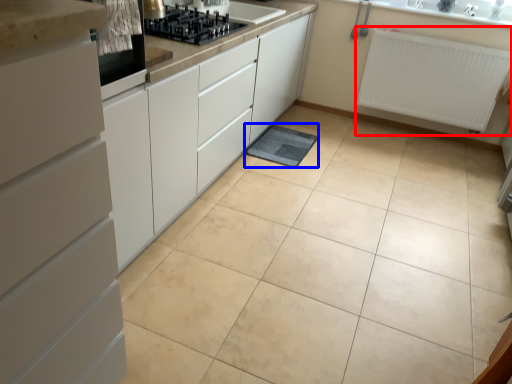
Question: Which of the following is the closest to the observer, radiator (highlighted by a red box) or bath mat (highlighted by a blue box)?

Choices:
 (A) radiator
 (B) bath mat

Answer: (B)